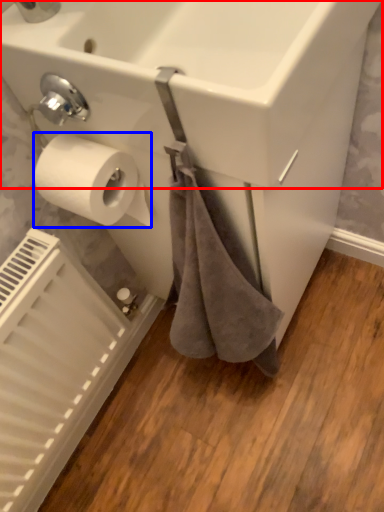
Question: Which object is further to the camera taking this photo, sink (highlighted by a red box) or toilet paper (highlighted by a blue box)?

Choices:
 (A) sink
 (B) toilet paper

Answer: (B)